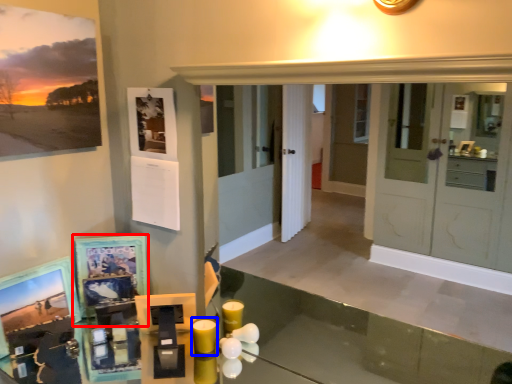
Question: Which point is closer to the camera, picture frame (highlighted by a red box) or candle (highlighted by a blue box)?

Choices:
 (A) picture frame
 (B) candle

Answer: (B)